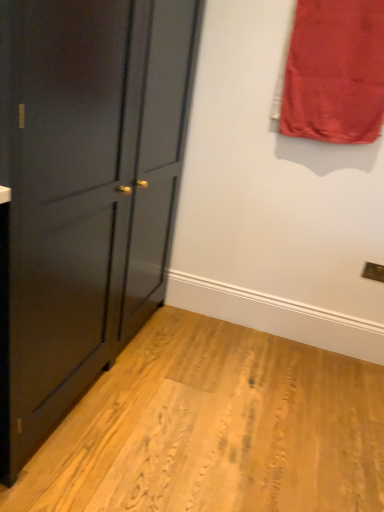
Question: In terms of size, does matte black cabinet at left appear bigger or smaller than red satin curtain at upper right?

Choices:
 (A) small
 (B) big

Answer: (B)

Question: Is point (89, 200) closer or farther from the camera than point (306, 125)?

Choices:
 (A) closer
 (B) farther

Answer: (A)

Question: Is matte black cabinet at left wider or thinner than red satin curtain at upper right?

Choices:
 (A) thin
 (B) wide

Answer: (B)

Question: In terms of size, does red satin curtain at upper right appear bigger or smaller than matte black cabinet at left?

Choices:
 (A) small
 (B) big

Answer: (A)

Question: From a real-world perspective, is red satin curtain at upper right positioned above or below matte black cabinet at left?

Choices:
 (A) below
 (B) above

Answer: (B)

Question: Considering the positions of point (304, 9) and point (49, 135), is point (304, 9) closer or farther from the camera than point (49, 135)?

Choices:
 (A) closer
 (B) farther

Answer: (B)

Question: From the image's perspective, is red satin curtain at upper right positioned above or below matte black cabinet at left?

Choices:
 (A) above
 (B) below

Answer: (A)